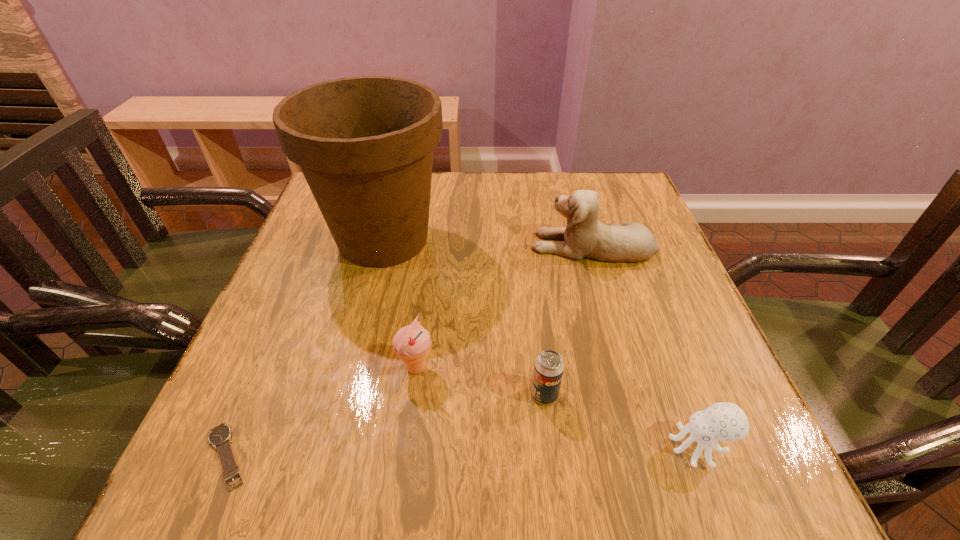
Find the location of `empty space between the fifth shortest object and the tallest object`. empty space between the fifth shortest object and the tallest object is located at coordinates (488, 242).

This screenshot has width=960, height=540. I want to click on empty space between the tallest object and the octopus, so click(x=541, y=342).

The image size is (960, 540). I want to click on vacant point located between the watch and the octopus, so click(x=463, y=451).

You are a GUI agent. You are given a task and a screenshot of the screen. Output one action in this format:
    pyautogui.click(x=<x>, y=<y>)
    Task: Click on the vacant point located between the octopus and the icecream
    Image resolution: width=960 pixels, height=540 pixels.
    Given the screenshot: What is the action you would take?
    pyautogui.click(x=558, y=407)

Find the location of `vacant area between the octopus and the beer can`. vacant area between the octopus and the beer can is located at coordinates (622, 420).

You are a GUI agent. You are given a task and a screenshot of the screen. Output one action in this format:
    pyautogui.click(x=<x>, y=<y>)
    Task: Click on the vacant area that lies between the beer can and the third tallest object
    
    Given the screenshot: What is the action you would take?
    pyautogui.click(x=480, y=381)

Locate an element on the screen. The width and height of the screenshot is (960, 540). empty space between the beer can and the fourth shortest object is located at coordinates (480, 381).

Image resolution: width=960 pixels, height=540 pixels. Find the location of `free space between the octopus and the shortest object`. free space between the octopus and the shortest object is located at coordinates (463, 451).

I want to click on vacant point located between the tallest object and the octopus, so click(x=541, y=342).

Point out which object is positioned as the third nearest to the icecream. Please provide its 2D coordinates. Your answer should be formatted as a tuple, i.e. [(x, y)], where the tuple contains the x and y coordinates of a point satisfying the conditions above.

[(220, 436)]